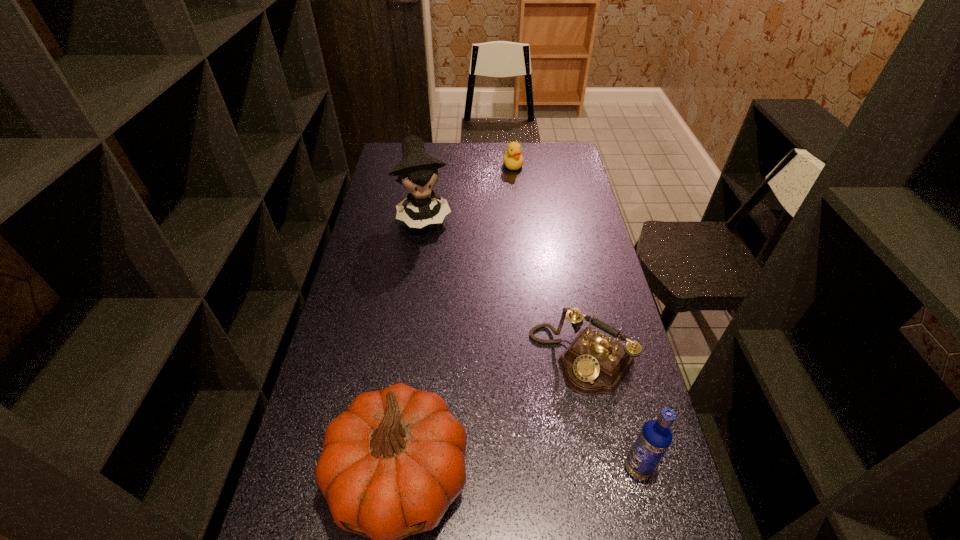
Locate an element on the screen. telephone that is at the right edge is located at coordinates (593, 364).

Find the location of a particular element. This screenshot has height=540, width=960. blank space at the far edge is located at coordinates (478, 156).

Locate an element on the screen. The height and width of the screenshot is (540, 960). vacant position at the near edge of the desktop is located at coordinates (481, 532).

Find the location of `free space at the left edge of the desktop`. free space at the left edge of the desktop is located at coordinates (374, 225).

Where is `vacant space at the right edge`? The image size is (960, 540). vacant space at the right edge is located at coordinates (654, 477).

In the image, there is a desktop. Identify the location of free region at the far right corner. pyautogui.click(x=571, y=161).

What are the coordinates of `free space that is in between the farthest object and the second farthest object` in the screenshot? It's located at coord(469,190).

The height and width of the screenshot is (540, 960). I want to click on vacant area that lies between the doll and the vodka, so click(531, 341).

Where is `free space that is in between the doll and the vodka`? free space that is in between the doll and the vodka is located at coordinates (531, 341).

Find the location of a particular element. The width and height of the screenshot is (960, 540). vacant space that's between the duckling and the doll is located at coordinates (469, 190).